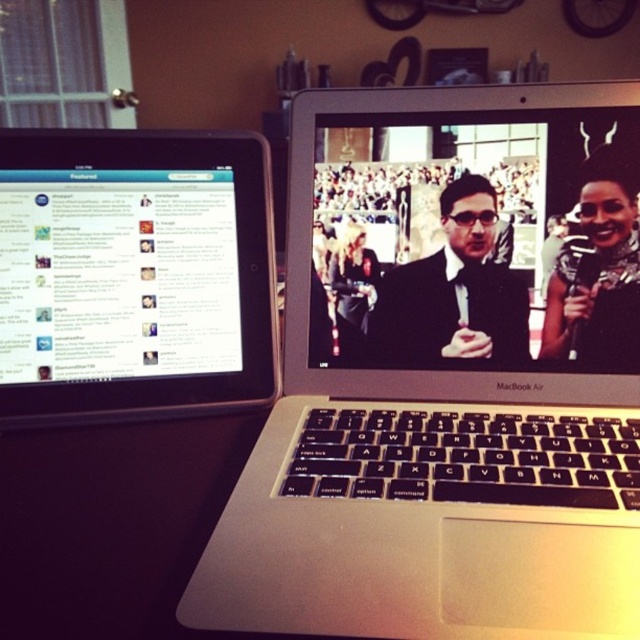
From the picture: Can you confirm if satin black laptop at center is positioned above black glossy microphone at right?

Yes.

Can you confirm if satin black laptop at center is positioned below black glossy microphone at right?

No.

Is point (538, 209) more distant than point (598, 256)?

Yes, it is behind point (598, 256).

I want to click on satin black laptop at center, so click(465, 243).

Which of these two, satin black laptop at center or black glossy tablet at left, stands taller?

satin black laptop at center is taller.

Is point (532, 330) closer to camera compared to point (156, 260)?

Yes.

Image resolution: width=640 pixels, height=640 pixels. I want to click on satin black laptop at center, so click(465, 243).

Is silver metallic laptop at center above black glossy microphone at right?

No, silver metallic laptop at center is not above black glossy microphone at right.

Consider the image. Is silver metallic laptop at center below black glossy microphone at right?

Yes, silver metallic laptop at center is below black glossy microphone at right.

Where is `silver metallic laptop at center`? Image resolution: width=640 pixels, height=640 pixels. silver metallic laptop at center is located at coordinates (449, 376).